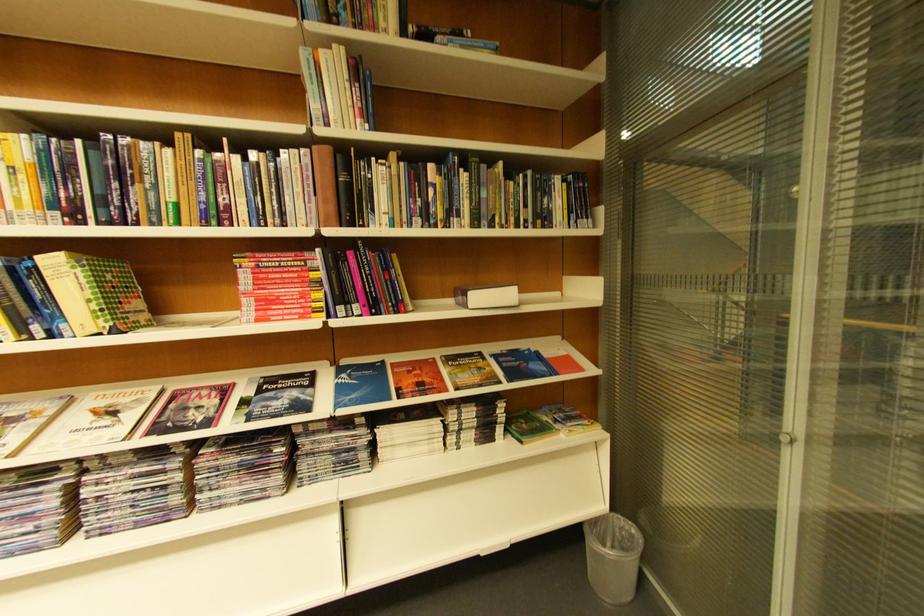
Locate an element on the screen. Image resolution: width=924 pixels, height=616 pixels. black spine book is located at coordinates (345, 190).